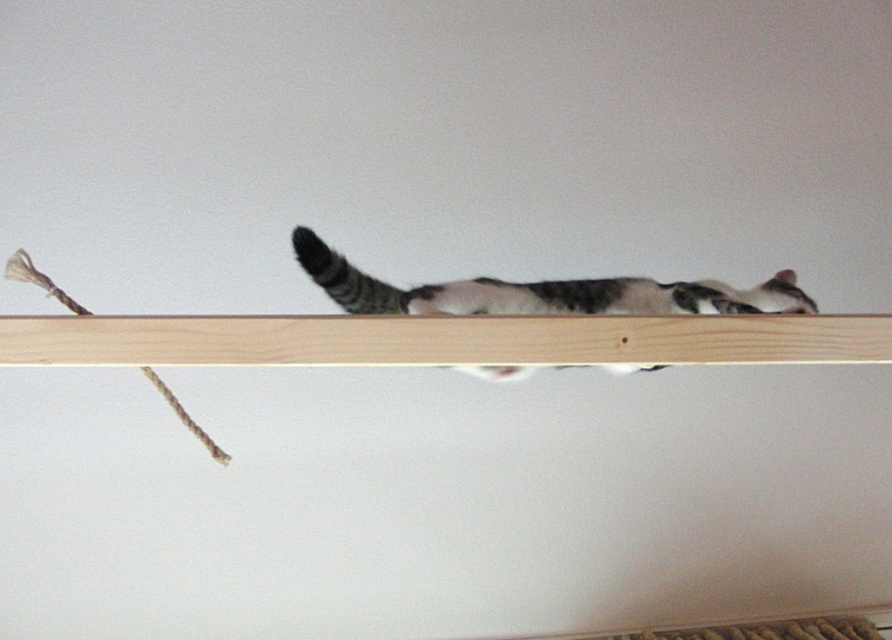
What do you see at coordinates (443, 340) in the screenshot? The height and width of the screenshot is (640, 892). I see `light wood shelf at center` at bounding box center [443, 340].

Who is more forward, (632, 355) or (370, 296)?

Point (632, 355)

Is point (65, 330) positioned before point (527, 310)?

Yes, point (65, 330) is closer to viewer.

At what (x,y) coordinates should I click in order to perform the action: click on light wood shelf at center. Please return your answer as a coordinate pair (x, y). Looking at the image, I should click on (443, 340).